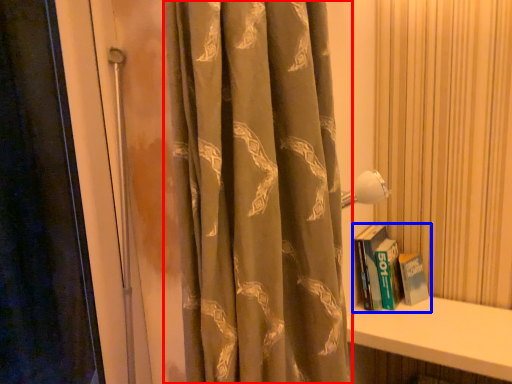
Question: Which of the following is the farthest to the observer, curtain (highlighted by a red box) or book (highlighted by a blue box)?

Choices:
 (A) curtain
 (B) book

Answer: (B)